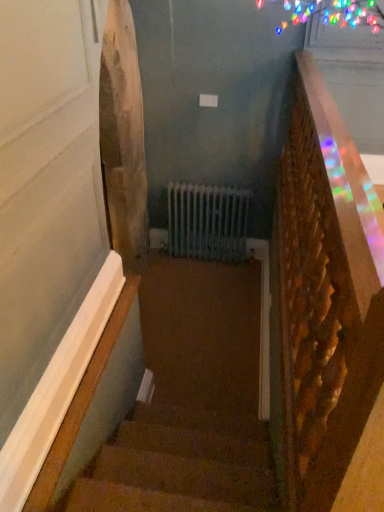
Question: Does point (292, 436) appear closer or farther from the camera than point (152, 266)?

Choices:
 (A) farther
 (B) closer

Answer: (B)

Question: From their relative heights in the image, would you say wooden textured rail at right is taller or shorter than carpeted stairs at center?

Choices:
 (A) tall
 (B) short

Answer: (A)

Question: Based on their positions, is wooden textured rail at right located to the left or right of carpeted stairs at center?

Choices:
 (A) right
 (B) left

Answer: (A)

Question: Considering the positions of carpeted stairs at center and wooden textured rail at right in the image, is carpeted stairs at center wider or thinner than wooden textured rail at right?

Choices:
 (A) thin
 (B) wide

Answer: (B)

Question: Considering their positions, is carpeted stairs at center located in front of or behind wooden textured rail at right?

Choices:
 (A) behind
 (B) front

Answer: (A)

Question: Is point (201, 373) positioned closer to the camera than point (369, 202)?

Choices:
 (A) farther
 (B) closer

Answer: (A)

Question: Is carpeted stairs at center spatially inside wooden textured rail at right, or outside of it?

Choices:
 (A) outside
 (B) inside

Answer: (A)